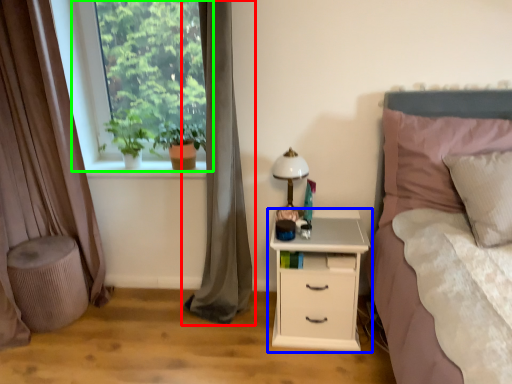
Question: Which object is positioned farthest from curtain (highlighted by a red box)? Select from nightstand (highlighted by a blue box) and window (highlighted by a green box).

Choices:
 (A) nightstand
 (B) window

Answer: (B)